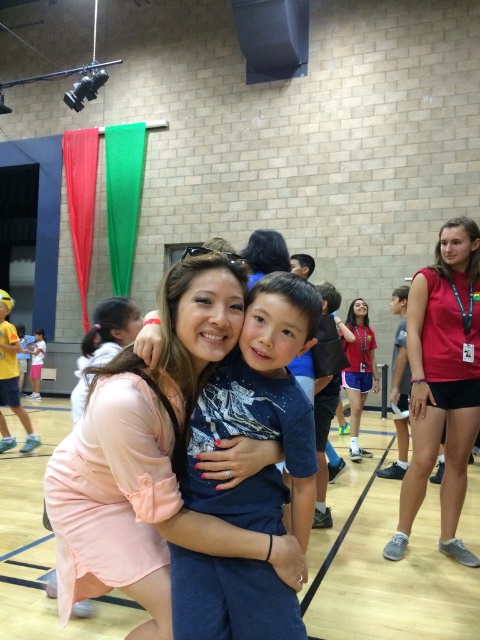
Question: Which point is closer to the camera taking this photo?

Choices:
 (A) (93, 500)
 (B) (451, 518)
 (C) (17, 387)
 (D) (290, 346)

Answer: (D)

Question: Which of these objects is positioned closest to the blue cotton shirt at center?

Choices:
 (A) pink fabric dress at center
 (B) matte red shirt at right

Answer: (A)

Question: Can you confirm if pink fabric dress at center is positioned above light pink dress at center?

Choices:
 (A) no
 (B) yes

Answer: (B)

Question: Is pink fabric dress at center smaller than matte red shirt at right?

Choices:
 (A) no
 (B) yes

Answer: (B)

Question: Among these points, which one is nearest to the camera?

Choices:
 (A) (140, 548)
 (B) (3, 356)

Answer: (A)

Question: Does pink fabric dress at center appear on the left side of blue cotton shirt at center?

Choices:
 (A) yes
 (B) no

Answer: (A)